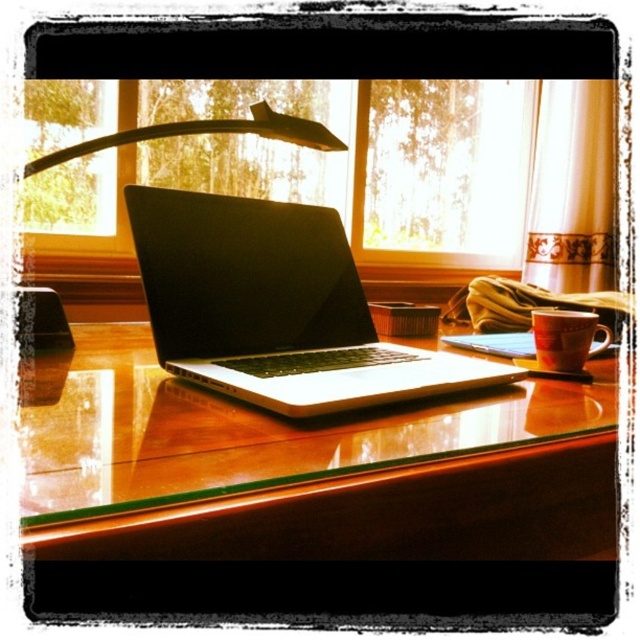
Question: Can you confirm if black plastic lamp at upper center is positioned to the left of matte ceramic mug at right?

Choices:
 (A) yes
 (B) no

Answer: (A)

Question: Which is farther from the black plastic lamp at upper center?

Choices:
 (A) matte ceramic mug at right
 (B) transparent glass window at center
 (C) glossy wood table at center

Answer: (B)

Question: Based on their relative distances, which object is farther from the black plastic lamp at upper center?

Choices:
 (A) sleek silver laptop at center
 (B) transparent glass window at center

Answer: (B)

Question: Considering the real-world distances, which object is closest to the glossy wood table at center?

Choices:
 (A) transparent glass window at center
 (B) black plastic lamp at upper center
 (C) matte ceramic mug at right
 (D) sleek silver laptop at center

Answer: (D)

Question: In this image, where is sleek silver laptop at center located relative to matte ceramic mug at right?

Choices:
 (A) above
 (B) below

Answer: (A)

Question: Is glossy wood table at center below sleek silver laptop at center?

Choices:
 (A) yes
 (B) no

Answer: (A)